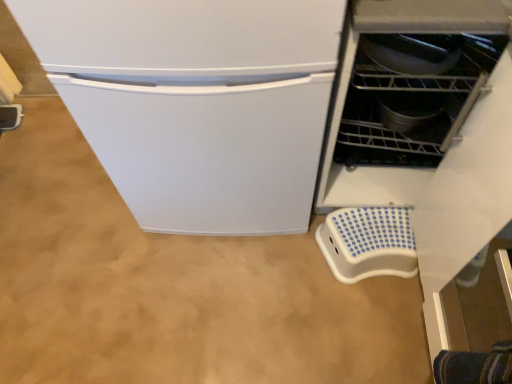
Image resolution: width=512 pixels, height=384 pixels. In order to click on blue dotted plastic step stool at lower right in this screenshot , I will do `click(368, 243)`.

What do you see at coordinates (368, 243) in the screenshot? I see `blue dotted plastic step stool at lower right` at bounding box center [368, 243].

Locate an element on the screen. This screenshot has width=512, height=384. metallic gray dishwasher at right is located at coordinates (393, 124).

What do you see at coordinates (393, 124) in the screenshot?
I see `metallic gray dishwasher at right` at bounding box center [393, 124].

Measure the distance between metallic gray dishwasher at right and camera.

metallic gray dishwasher at right and camera are 31.92 inches apart from each other.

In order to click on blue dotted plastic step stool at lower right in this screenshot , I will do `click(368, 243)`.

Is blue dotted plastic step stool at lower right at the right side of metallic gray dishwasher at right?

Correct, you'll find blue dotted plastic step stool at lower right to the right of metallic gray dishwasher at right.

Is blue dotted plastic step stool at lower right positioned before metallic gray dishwasher at right?

No, the depth of blue dotted plastic step stool at lower right is greater than that of metallic gray dishwasher at right.

Is point (395, 218) closer or farther from the camera than point (343, 172)?

Point (395, 218) appears to be closer to the viewer than point (343, 172).

From the image's perspective, does blue dotted plastic step stool at lower right appear higher than metallic gray dishwasher at right?

No.

From a real-world perspective, is blue dotted plastic step stool at lower right under metallic gray dishwasher at right?

Yes, from a real-world perspective, blue dotted plastic step stool at lower right is beneath metallic gray dishwasher at right.

Is blue dotted plastic step stool at lower right wider or thinner than metallic gray dishwasher at right?

In the image, blue dotted plastic step stool at lower right appears to be more narrow than metallic gray dishwasher at right.

Can you confirm if blue dotted plastic step stool at lower right is shorter than metallic gray dishwasher at right?

Indeed, blue dotted plastic step stool at lower right has a lesser height compared to metallic gray dishwasher at right.

Considering the relative sizes of blue dotted plastic step stool at lower right and metallic gray dishwasher at right in the image provided, is blue dotted plastic step stool at lower right smaller than metallic gray dishwasher at right?

Yes.

Do you think blue dotted plastic step stool at lower right is within metallic gray dishwasher at right, or outside of it?

blue dotted plastic step stool at lower right cannot be found inside metallic gray dishwasher at right.

Is blue dotted plastic step stool at lower right not close to metallic gray dishwasher at right?

No.

Is blue dotted plastic step stool at lower right looking in the opposite direction of metallic gray dishwasher at right?

No, blue dotted plastic step stool at lower right's orientation is not away from metallic gray dishwasher at right.

How many degrees apart are the facing directions of blue dotted plastic step stool at lower right and metallic gray dishwasher at right?

blue dotted plastic step stool at lower right and metallic gray dishwasher at right are facing 88.8 degrees away from each other.

Measure the distance between blue dotted plastic step stool at lower right and metallic gray dishwasher at right.

blue dotted plastic step stool at lower right and metallic gray dishwasher at right are 9.94 inches apart.

The width and height of the screenshot is (512, 384). Find the location of `dish washer above the blue dotted plastic step stool at lower right (from a real-world perspective)`. dish washer above the blue dotted plastic step stool at lower right (from a real-world perspective) is located at coordinates (393, 124).

Is metallic gray dishwasher at right at the right side of blue dotted plastic step stool at lower right?

In fact, metallic gray dishwasher at right is to the left of blue dotted plastic step stool at lower right.

Considering the relative positions of metallic gray dishwasher at right and blue dotted plastic step stool at lower right in the image provided, is metallic gray dishwasher at right behind blue dotted plastic step stool at lower right?

No, it is not.

Is point (429, 163) closer to camera compared to point (342, 254)?

Yes, it is.

From the image's perspective, is metallic gray dishwasher at right under blue dotted plastic step stool at lower right?

No, from the image's perspective, metallic gray dishwasher at right is not below blue dotted plastic step stool at lower right.

From a real-world perspective, is metallic gray dishwasher at right under blue dotted plastic step stool at lower right?

No, from a real-world perspective, metallic gray dishwasher at right is not under blue dotted plastic step stool at lower right.

In the scene shown: Considering the relative sizes of metallic gray dishwasher at right and blue dotted plastic step stool at lower right in the image provided, is metallic gray dishwasher at right thinner than blue dotted plastic step stool at lower right?

In fact, metallic gray dishwasher at right might be wider than blue dotted plastic step stool at lower right.

Considering the sizes of metallic gray dishwasher at right and blue dotted plastic step stool at lower right in the image, is metallic gray dishwasher at right taller or shorter than blue dotted plastic step stool at lower right?

Clearly, metallic gray dishwasher at right is taller compared to blue dotted plastic step stool at lower right.

Is metallic gray dishwasher at right bigger or smaller than blue dotted plastic step stool at lower right?

Considering their sizes, metallic gray dishwasher at right takes up more space than blue dotted plastic step stool at lower right.

Would you say metallic gray dishwasher at right is outside blue dotted plastic step stool at lower right?

metallic gray dishwasher at right is positioned outside blue dotted plastic step stool at lower right.

Is metallic gray dishwasher at right far away from blue dotted plastic step stool at lower right?

metallic gray dishwasher at right is actually quite close to blue dotted plastic step stool at lower right.

Is metallic gray dishwasher at right facing away from blue dotted plastic step stool at lower right?

No.

What's the angular difference between metallic gray dishwasher at right and blue dotted plastic step stool at lower right's facing directions?

metallic gray dishwasher at right and blue dotted plastic step stool at lower right are facing 88.8 degrees away from each other.

The image size is (512, 384). What are the coordinates of `dish washer above the blue dotted plastic step stool at lower right (from the image's perspective)` in the screenshot? It's located at (393, 124).

The width and height of the screenshot is (512, 384). Identify the location of dish washer in front of the blue dotted plastic step stool at lower right. (393, 124).

Where is `dish washer positioned vertically above the blue dotted plastic step stool at lower right (from a real-world perspective)`? This screenshot has width=512, height=384. dish washer positioned vertically above the blue dotted plastic step stool at lower right (from a real-world perspective) is located at coordinates (393, 124).